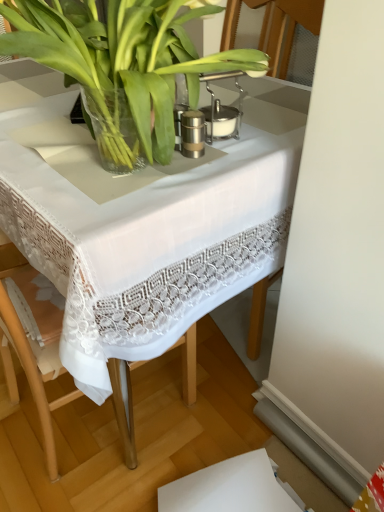
Question: Is point (87, 251) closer or farther from the camera than point (162, 45)?

Choices:
 (A) closer
 (B) farther

Answer: (A)

Question: Is white lace tablecloth at center in front of or behind green leafy plant at center in the image?

Choices:
 (A) front
 (B) behind

Answer: (B)

Question: From a real-world perspective, is white lace tablecloth at center positioned above or below green leafy plant at center?

Choices:
 (A) above
 (B) below

Answer: (B)

Question: Looking at the image, does green leafy plant at center seem bigger or smaller compared to white lace tablecloth at center?

Choices:
 (A) big
 (B) small

Answer: (B)

Question: Is green leafy plant at center inside the boundaries of white lace tablecloth at center, or outside?

Choices:
 (A) inside
 (B) outside

Answer: (B)

Question: Considering the positions of point (162, 55) and point (261, 215), is point (162, 55) closer or farther from the camera than point (261, 215)?

Choices:
 (A) farther
 (B) closer

Answer: (B)

Question: From a real-world perspective, is green leafy plant at center physically located above or below white lace tablecloth at center?

Choices:
 (A) above
 (B) below

Answer: (A)